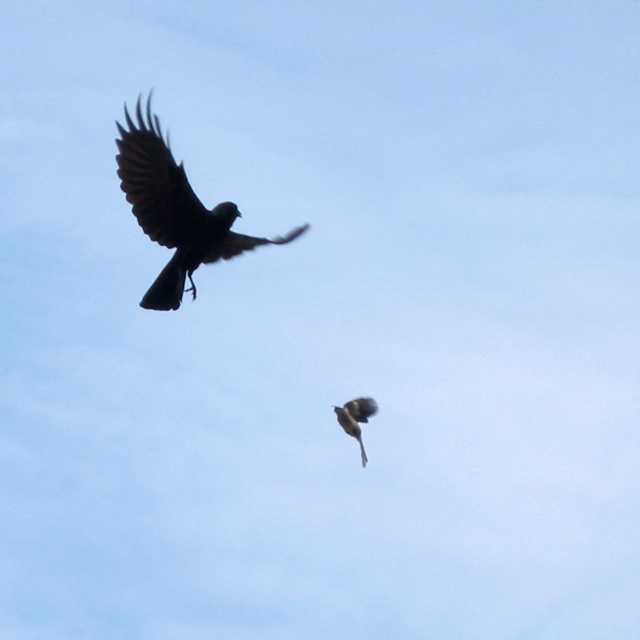
Question: Is silhouette glossy bird at upper left closer to the viewer compared to silvery metallic bird at lower center?

Choices:
 (A) no
 (B) yes

Answer: (A)

Question: Is silhouette glossy bird at upper left below silvery metallic bird at lower center?

Choices:
 (A) yes
 (B) no

Answer: (B)

Question: Which of the following is the closest to the observer?

Choices:
 (A) (360, 397)
 (B) (164, 282)

Answer: (A)

Question: Does silhouette glossy bird at upper left appear over silvery metallic bird at lower center?

Choices:
 (A) no
 (B) yes

Answer: (B)

Question: Which object is farther from the camera taking this photo?

Choices:
 (A) silhouette glossy bird at upper left
 (B) silvery metallic bird at lower center

Answer: (A)